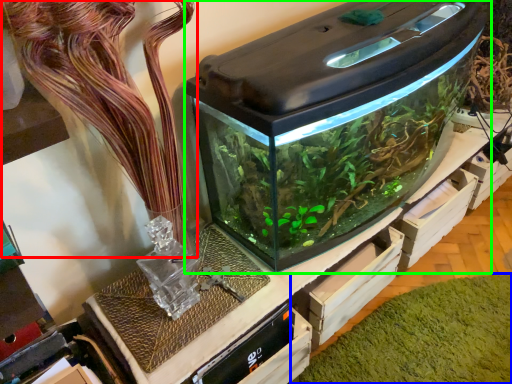
Question: Which is nearer to the plant (highlighted by a red box)? algae (highlighted by a blue box) or home appliance (highlighted by a green box).

Choices:
 (A) algae
 (B) home appliance

Answer: (B)